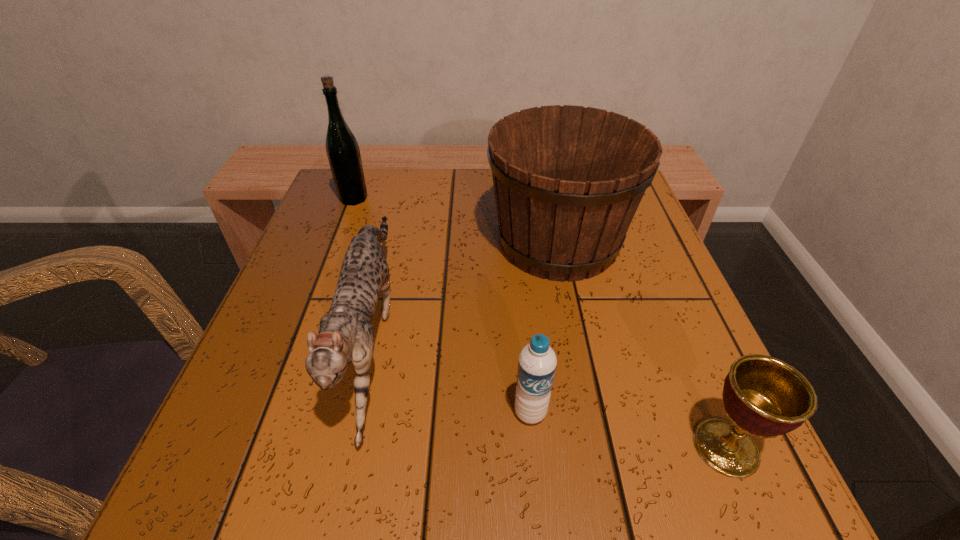
At what (x,y) coordinates should I click in order to perform the action: click on beer bottle located in the far edge section of the desktop. Please return your answer as a coordinate pair (x, y). The height and width of the screenshot is (540, 960). Looking at the image, I should click on (x=342, y=148).

Locate an element on the screen. This screenshot has width=960, height=540. wine bucket that is positioned at the far edge is located at coordinates (568, 180).

Find the location of a particular element. Image resolution: width=960 pixels, height=540 pixels. cat that is positioned at the near edge is located at coordinates 345,334.

Find the location of a particular element. This screenshot has height=540, width=960. chalice situated at the near edge is located at coordinates (764, 397).

The width and height of the screenshot is (960, 540). In order to click on beer bottle present at the left edge in this screenshot , I will do `click(342, 148)`.

You are a GUI agent. You are given a task and a screenshot of the screen. Output one action in this format:
    pyautogui.click(x=<x>, y=<y>)
    Task: Click on the cat present at the left edge
    The image size is (960, 540).
    Given the screenshot: What is the action you would take?
    pyautogui.click(x=345, y=334)

Image resolution: width=960 pixels, height=540 pixels. I want to click on wine bucket present at the right edge, so click(x=568, y=180).

Image resolution: width=960 pixels, height=540 pixels. I want to click on chalice that is at the right edge, so pos(764,397).

Locate an element on the screen. object that is at the far left corner is located at coordinates (342, 148).

Where is `object located in the near left corner section of the desktop`? object located in the near left corner section of the desktop is located at coordinates (345, 334).